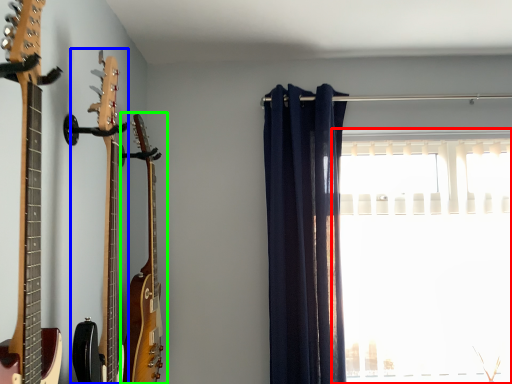
Question: Considering the real-world distances, which object is farthest from window (highlighted by a red box)? guitar (highlighted by a blue box) or guitar (highlighted by a green box)?

Choices:
 (A) guitar
 (B) guitar

Answer: (A)